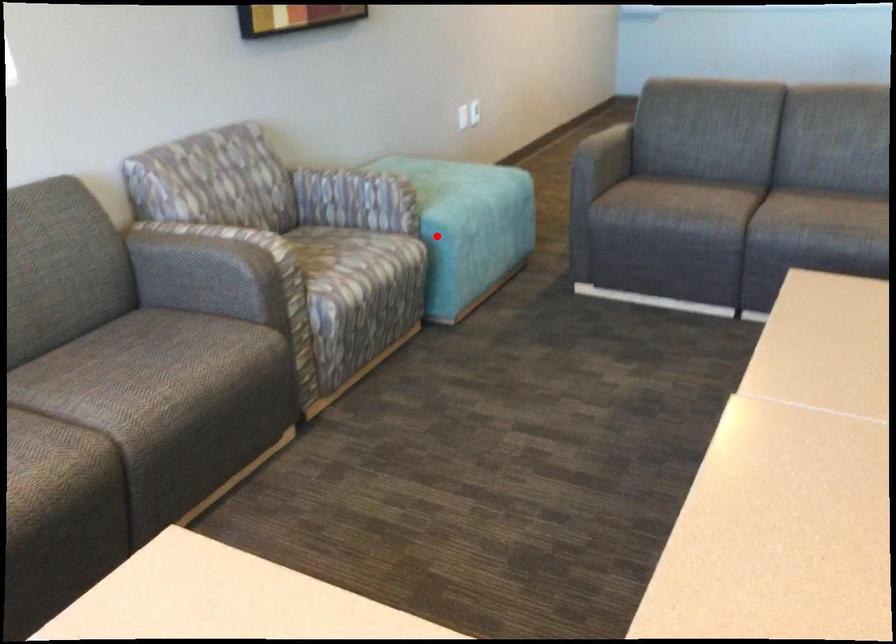
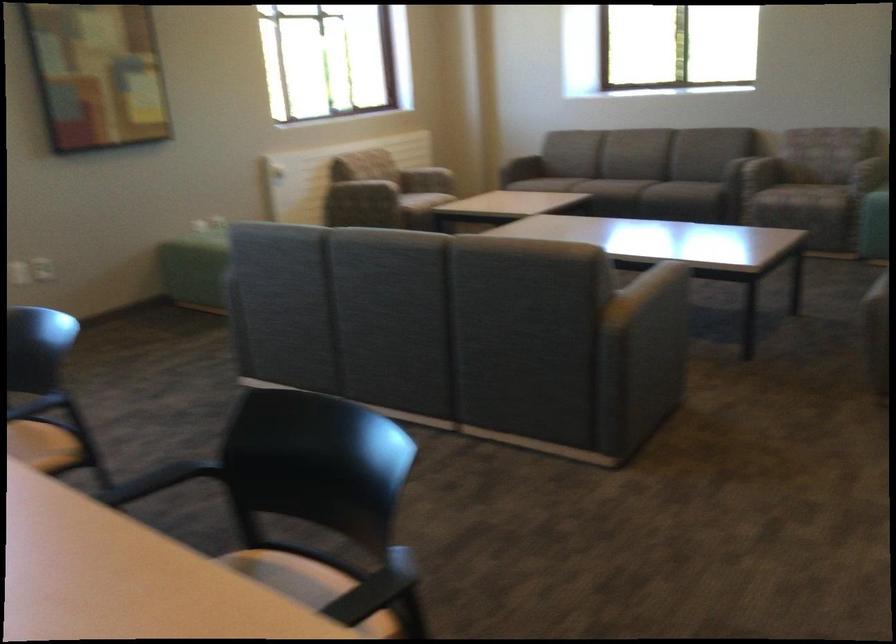
Question: I am providing you with two images of the same scene from different viewpoints. A red point is shown in image1. For the corresponding object point in image2, is it positioned nearer or farther from the camera?

Choices:
 (A) Nearer
 (B) Farther

Answer: (B)